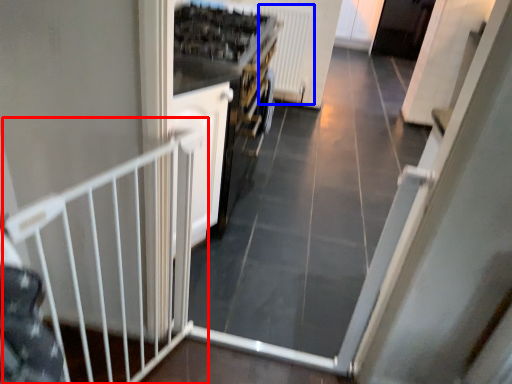
Question: Which object is further to the camera taking this photo, rail (highlighted by a red box) or radiator (highlighted by a blue box)?

Choices:
 (A) rail
 (B) radiator

Answer: (B)